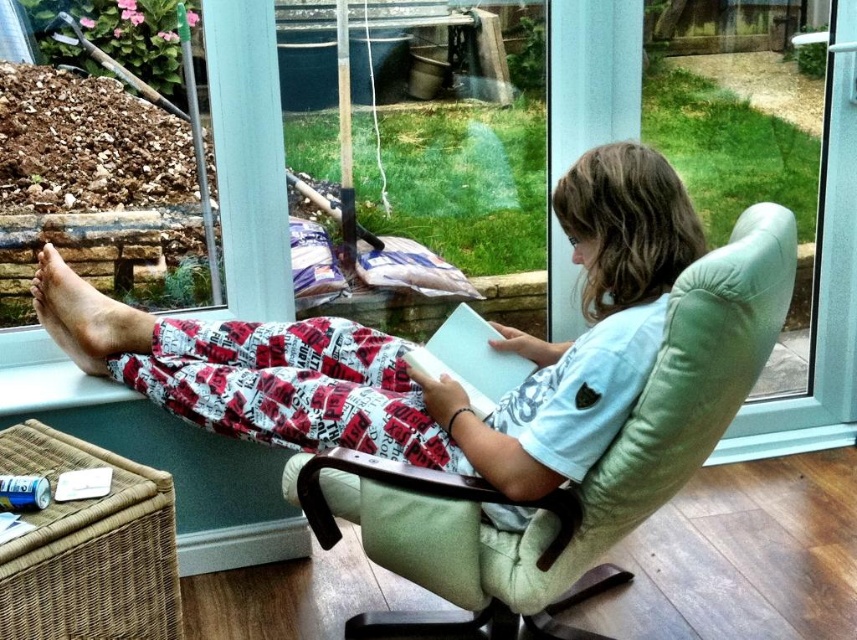
Can you confirm if light blue cotton shirt at center is taller than skinny barefoot at lower left?

Yes.

Can you confirm if light blue cotton shirt at center is smaller than skinny barefoot at lower left?

Actually, light blue cotton shirt at center might be larger than skinny barefoot at lower left.

Does point (54, 272) come behind point (129, 324)?

Yes, point (54, 272) is farther from viewer.

Image resolution: width=857 pixels, height=640 pixels. Find the location of `light blue cotton shirt at center`. light blue cotton shirt at center is located at coordinates (409, 348).